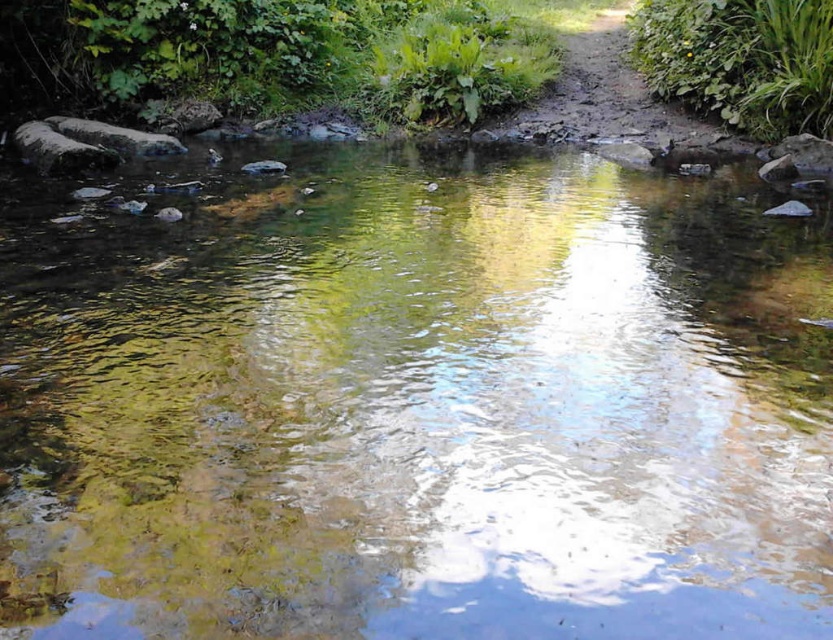
You are standing at the edge of the stream and see a point marked at coordinates (198,49). Which object from the scene does this point belong to?

The point at coordinates (198,49) is on green leafy plants at upper center.

You are standing at the edge of a shallow stream and want to reach the green leafy plants at upper center. The stream is 30 feet wide. Can you cross the stream directly to the plants without getting wet?

The green leafy plants at upper center is 31.94 feet away from viewer. The stream is 30 feet wide, so you can cross the stream directly to the plants without getting wet because the distance to the plants is slightly longer than the stream width, meaning the plants are on the other side.

You are standing at the origin point in the scene. There are two points marked in the image, point (133, 22) and point (721, 104). Which point is closer to you?

Point (721, 104) is closer to you because it is in front of point (133, 22).